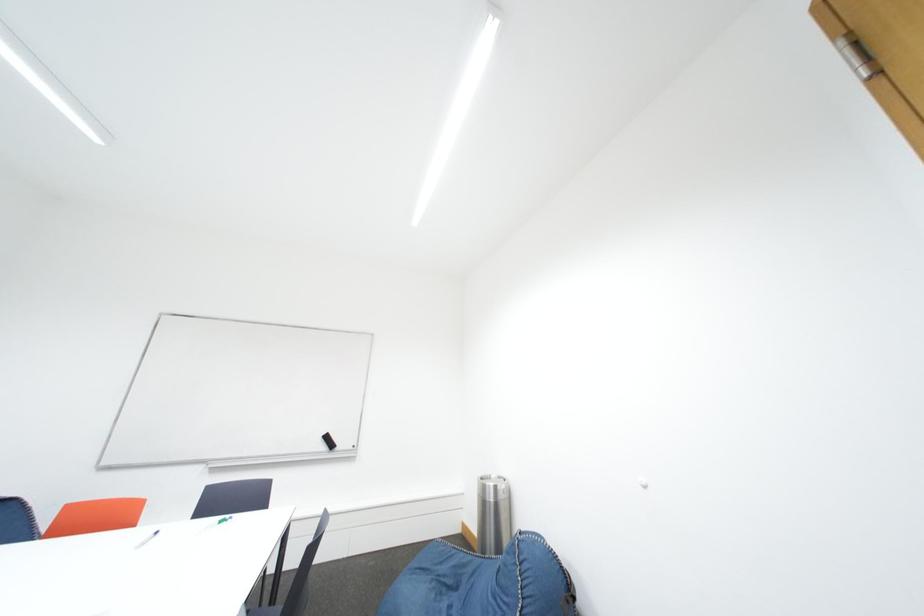
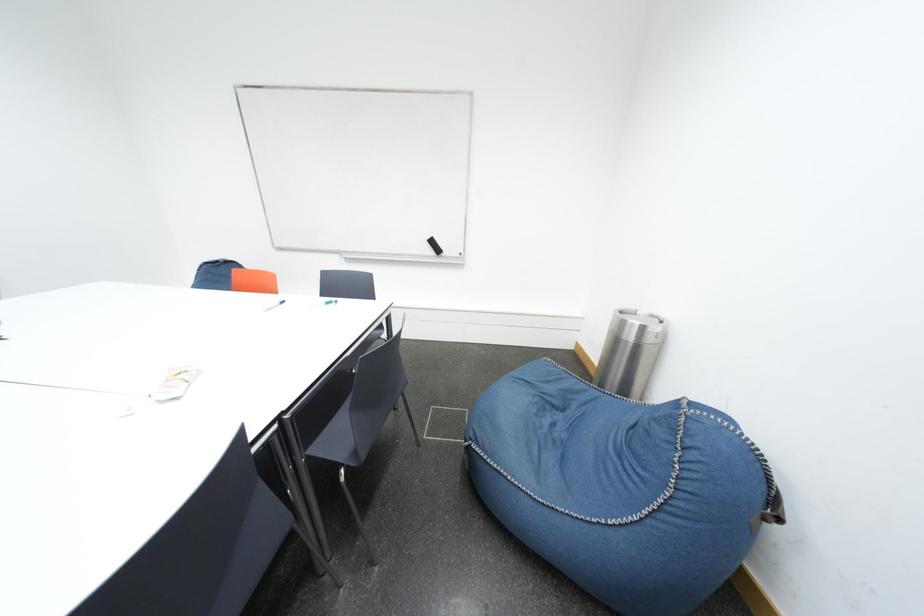
How did the camera likely rotate?

The camera rotated toward left-down.